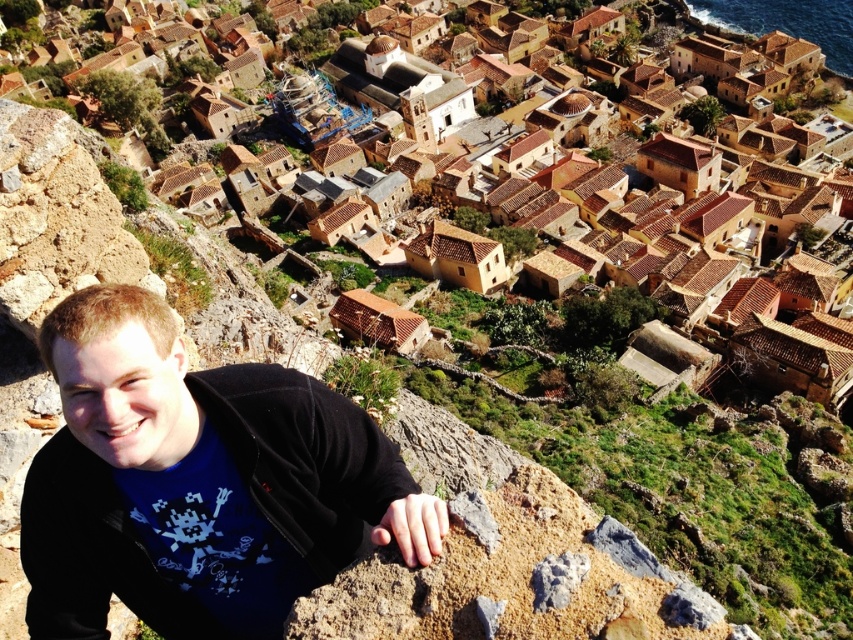
Question: Which point is closer to the camera?

Choices:
 (A) brown clay village at lower left
 (B) black matte jacket at lower left

Answer: (B)

Question: From the image, what is the correct spatial relationship of black matte jacket at lower left in relation to brown clay village at lower left?

Choices:
 (A) right
 (B) left

Answer: (B)

Question: Does black matte jacket at lower left appear on the right side of brown clay village at lower left?

Choices:
 (A) no
 (B) yes

Answer: (A)

Question: Does black matte jacket at lower left appear over brown clay village at lower left?

Choices:
 (A) no
 (B) yes

Answer: (A)